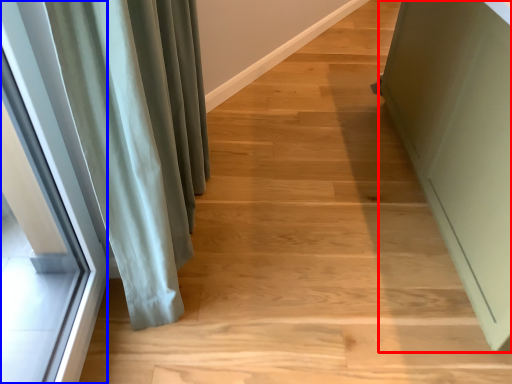
Question: Which of the following is the closest to the observer, screen door (highlighted by a red box) or window (highlighted by a blue box)?

Choices:
 (A) screen door
 (B) window

Answer: (B)